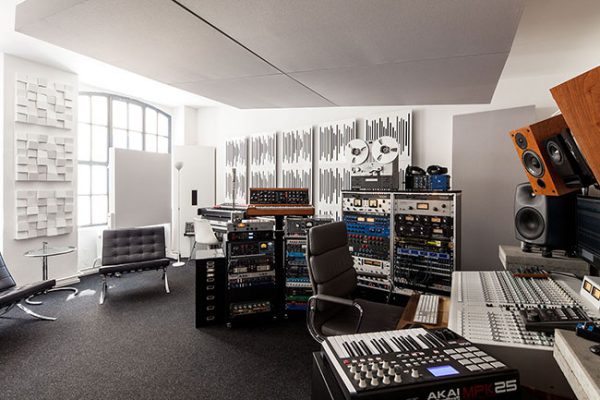
Locate an element on the screen. window is located at coordinates (109, 139).